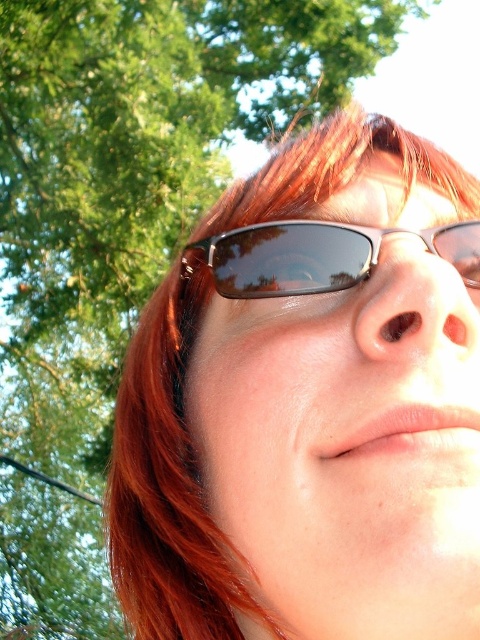
Is point (337, 118) behind point (360, 252)?

That is True.

Which is in front, point (145, 484) or point (253, 237)?

Positioned in front is point (253, 237).

Does point (203, 529) lie behind point (284, 237)?

Yes, point (203, 529) is farther from viewer.

Image resolution: width=480 pixels, height=640 pixels. Find the location of `matte brown sunglasses at upper center`. matte brown sunglasses at upper center is located at coordinates (164, 497).